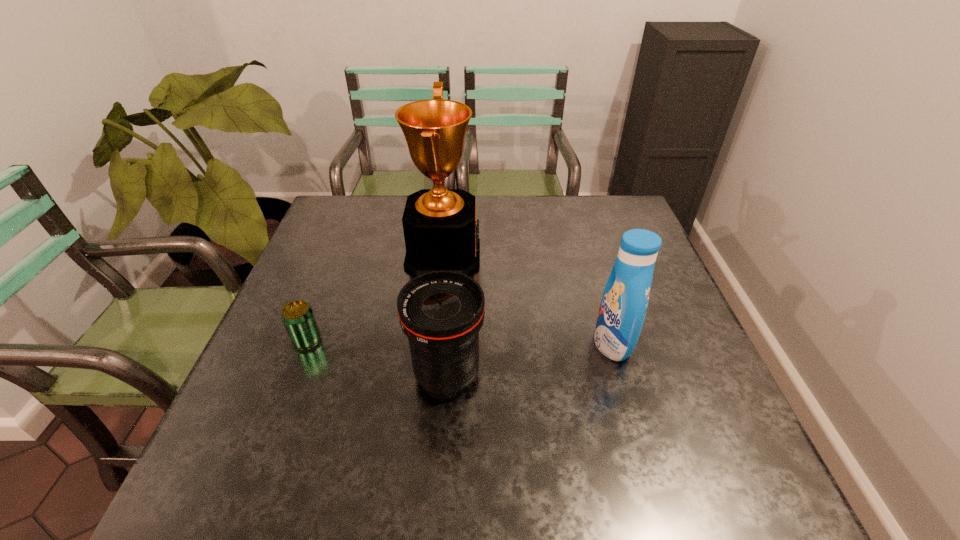
In the image, there is a desktop. Where is `blank space at the far left corner`? blank space at the far left corner is located at coordinates (359, 215).

Identify the location of vacant space at the far right corner of the desktop. The width and height of the screenshot is (960, 540). (635, 215).

Identify the location of free location at the near right corner. (772, 509).

At what (x,y) coordinates should I click in order to perform the action: click on unoccupied position between the rightmost object and the second shortest object. Please return your answer as a coordinate pair (x, y). Looking at the image, I should click on (530, 359).

Locate an element on the screen. Image resolution: width=960 pixels, height=540 pixels. vacant area that lies between the second shortest object and the detergent is located at coordinates (530, 359).

At what (x,y) coordinates should I click in order to perform the action: click on vacant space in between the telephoto lens and the detergent. Please return your answer as a coordinate pair (x, y). The width and height of the screenshot is (960, 540). Looking at the image, I should click on (530, 359).

Identify the location of blank region between the beer can and the tallest object. This screenshot has width=960, height=540. (375, 298).

I want to click on vacant area that lies between the detergent and the tallest object, so click(528, 299).

The image size is (960, 540). I want to click on object that is the second closest to the leftmost object, so click(x=441, y=312).

Where is `object that stands as the closest to the telephoto lens`? The height and width of the screenshot is (540, 960). object that stands as the closest to the telephoto lens is located at coordinates (439, 224).